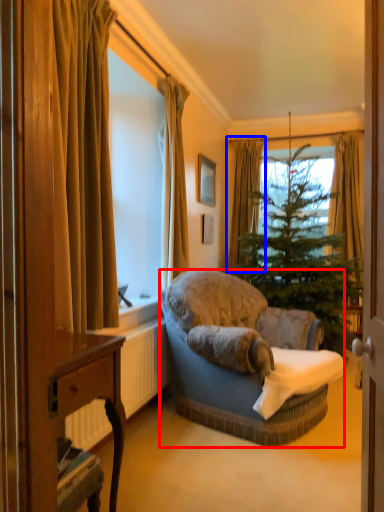
Question: Which object is closer to the camera taking this photo, studio couch (highlighted by a red box) or curtain (highlighted by a blue box)?

Choices:
 (A) studio couch
 (B) curtain

Answer: (A)